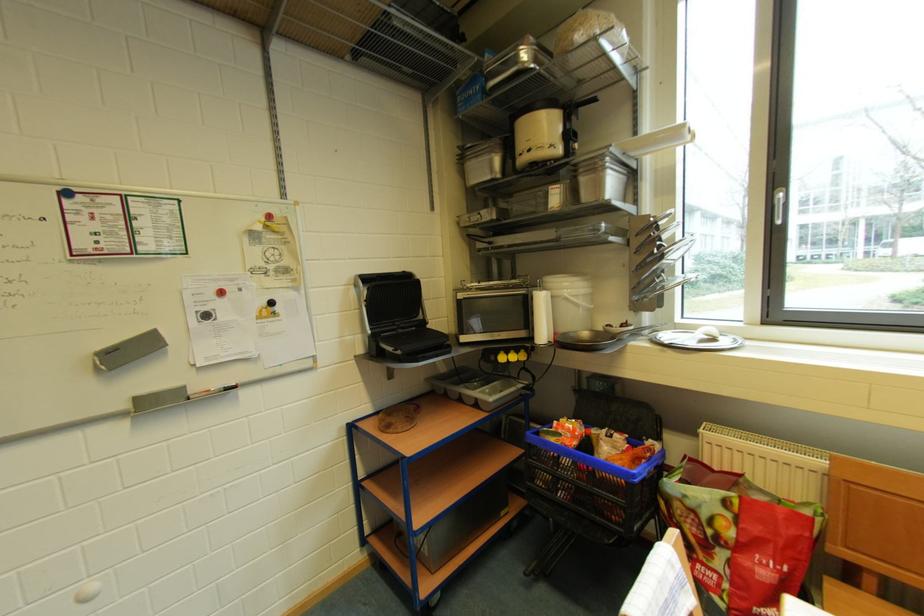
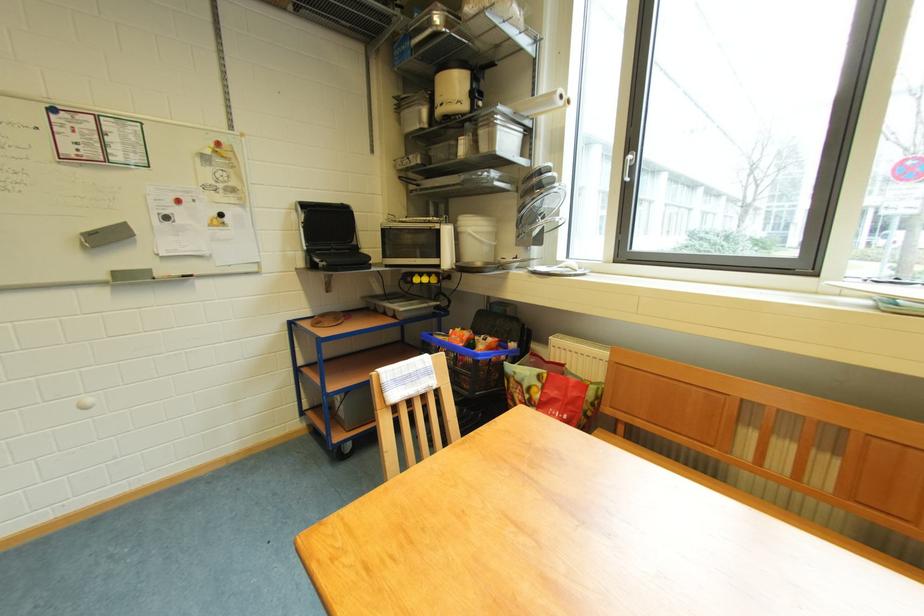
Locate, in the second image, the point that corresponds to pixel 520 360 in the first image.

(432, 283)